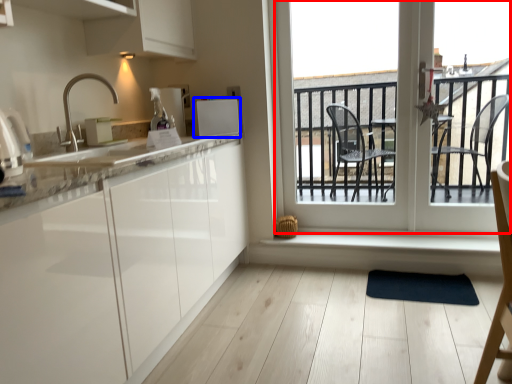
Question: Which object is further to the camera taking this photo, window (highlighted by a red box) or appliance (highlighted by a blue box)?

Choices:
 (A) window
 (B) appliance

Answer: (B)